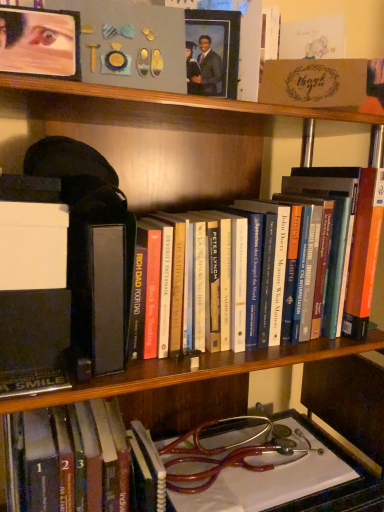
Question: Can you confirm if matte black picture frame at upper center is taller than hardcover book at center, positioned as the second book in top-to-bottom order?

Choices:
 (A) yes
 (B) no

Answer: (B)

Question: Is matte black picture frame at upper center aimed at hardcover book at center, positioned as the second book in top-to-bottom order?

Choices:
 (A) yes
 (B) no

Answer: (B)

Question: Does matte black picture frame at upper center touch hardcover book at center, positioned as the second book in top-to-bottom order?

Choices:
 (A) yes
 (B) no

Answer: (B)

Question: Can you confirm if matte black picture frame at upper center is positioned to the right of hardcover book at center, positioned as the second book in top-to-bottom order?

Choices:
 (A) no
 (B) yes

Answer: (B)

Question: Does matte black picture frame at upper center come behind hardcover book at center, positioned as the second book in top-to-bottom order?

Choices:
 (A) no
 (B) yes

Answer: (B)

Question: Considering the relative positions of hardcover book at center, positioned as the second book in top-to-bottom order, and hardcover book at center, the 1th book positioned from the top, in the image provided, is hardcover book at center, positioned as the second book in top-to-bottom order, to the left or to the right of hardcover book at center, the 1th book positioned from the top,?

Choices:
 (A) left
 (B) right

Answer: (A)

Question: From the image's perspective, is hardcover book at center, positioned as the second book in top-to-bottom order, positioned above or below hardcover book at center, the 1th book positioned from the top?

Choices:
 (A) below
 (B) above

Answer: (A)

Question: From a real-world perspective, is hardcover book at center, the first book in the bottom-to-top sequence, physically located above or below hardcover book at center, the second book when ordered from bottom to top?

Choices:
 (A) above
 (B) below

Answer: (B)

Question: From their relative heights in the image, would you say hardcover book at center, the first book in the bottom-to-top sequence, is taller or shorter than hardcover book at center, the second book when ordered from bottom to top?

Choices:
 (A) tall
 (B) short

Answer: (A)

Question: From a real-world perspective, is hardcover book at center, the second book when ordered from bottom to top, above or below matte black picture frame at upper center?

Choices:
 (A) above
 (B) below

Answer: (B)

Question: In terms of size, does hardcover book at center, the 1th book positioned from the top, appear bigger or smaller than matte black picture frame at upper center?

Choices:
 (A) small
 (B) big

Answer: (B)

Question: From the image's perspective, is hardcover book at center, the second book when ordered from bottom to top, above or below matte black picture frame at upper center?

Choices:
 (A) above
 (B) below

Answer: (B)

Question: Visually, is hardcover book at center, the second book when ordered from bottom to top, positioned to the left or to the right of matte black picture frame at upper center?

Choices:
 (A) right
 (B) left

Answer: (A)

Question: Is matte black picture frame at upper center wider or thinner than hardcover book at center, positioned as the second book in top-to-bottom order?

Choices:
 (A) thin
 (B) wide

Answer: (A)

Question: Choose the correct answer: Is matte black picture frame at upper center inside hardcover book at center, the first book in the bottom-to-top sequence, or outside it?

Choices:
 (A) inside
 (B) outside

Answer: (B)